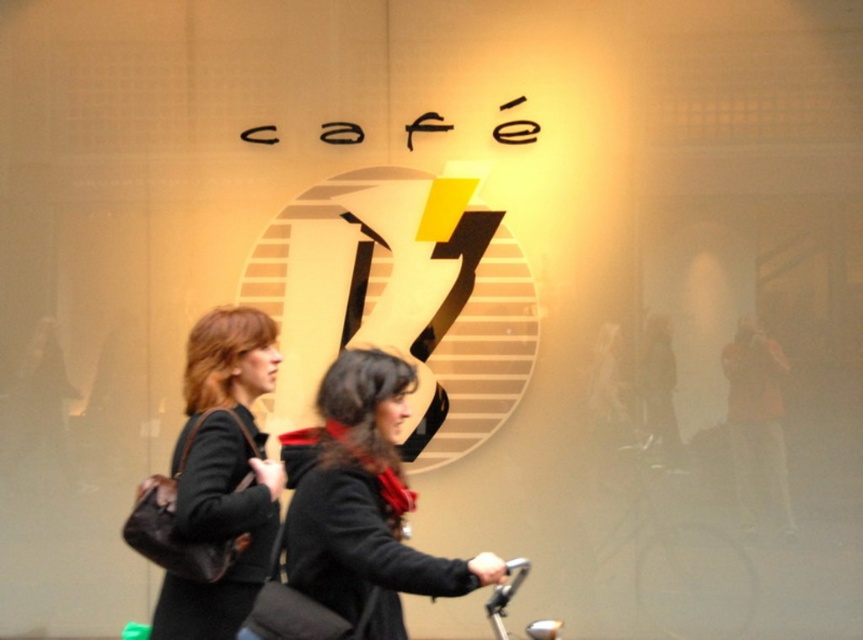
You are standing at the point with coordinates point (x=218, y=328) and want to walk to the point with coordinates point (x=348, y=404). Which direction should you move in to reach your destination?

To reach point (x=348, y=404) from point (x=218, y=328), you should move forward since point (x=348, y=404) is in front of point (x=218, y=328).

You are a fashion designer observing the two individuals in the scene. You need to determine which item is shorter between the black matte jacket at center and the matte black bag at left. Which one is shorter?

The black matte jacket at center is shorter than the matte black bag at left.